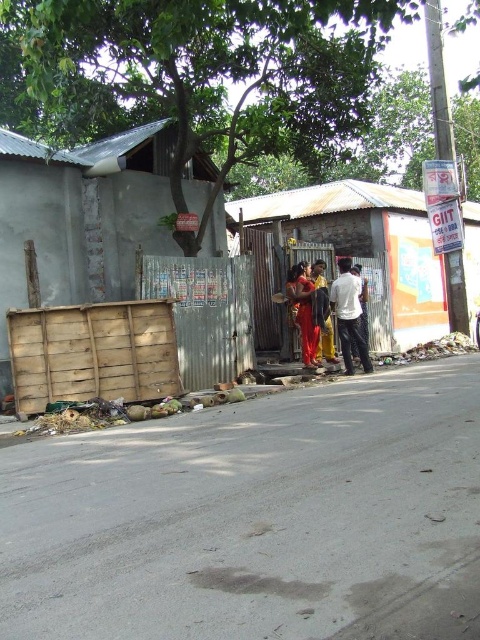
Which of these two, metallic corrugated hut at center or matte red dress at center, stands taller?

metallic corrugated hut at center is taller.

Describe the element at coordinates (367, 248) in the screenshot. I see `metallic corrugated hut at center` at that location.

Where is `metallic corrugated hut at center`? metallic corrugated hut at center is located at coordinates (367, 248).

Does point (214, 212) come closer to viewer compared to point (289, 272)?

No.

Identify the location of wooden fence at left. Image resolution: width=480 pixels, height=640 pixels. (82, 218).

Locate an element on the screen. This screenshot has width=480, height=640. wooden fence at left is located at coordinates (82, 218).

Is white matte shirt at center thinner than matte red dress at center?

Correct, white matte shirt at center's width is less than matte red dress at center's.

Who is more distant from viewer, (359, 340) or (308, 280)?

Positioned behind is point (308, 280).

What do you see at coordinates (348, 314) in the screenshot? This screenshot has width=480, height=640. I see `white matte shirt at center` at bounding box center [348, 314].

At what (x,y) coordinates should I click in order to perform the action: click on white matte shirt at center. Please return your answer as a coordinate pair (x, y). The image size is (480, 640). Looking at the image, I should click on (348, 314).